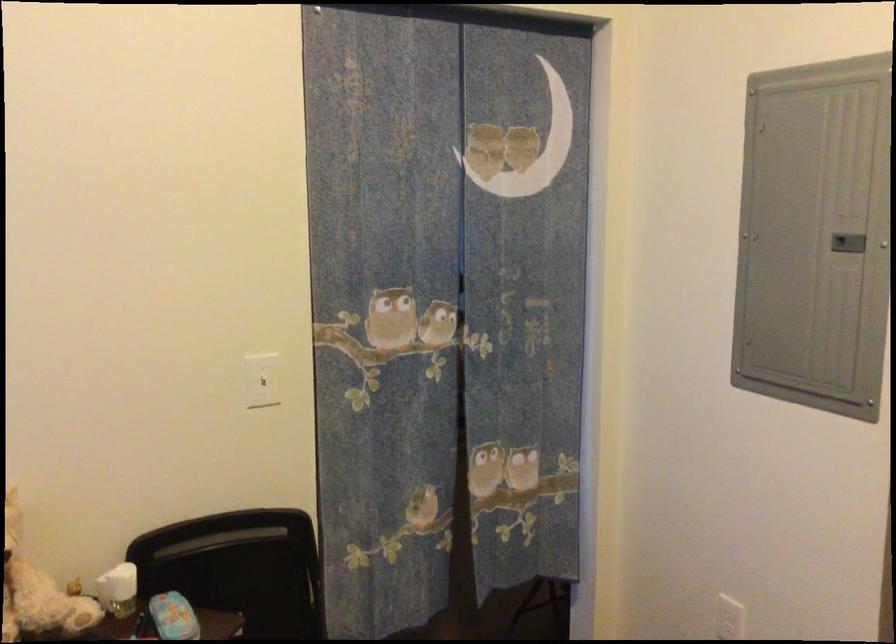
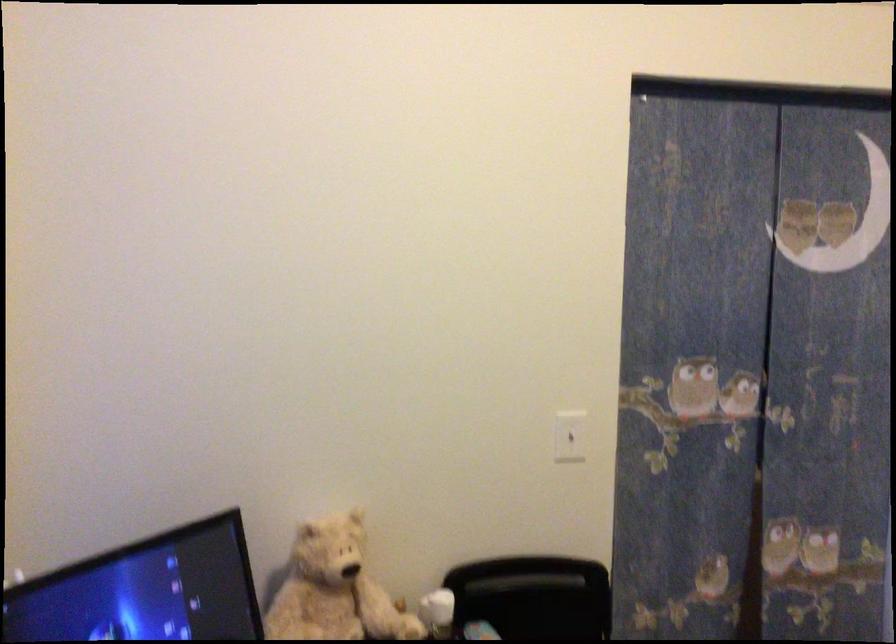
The point at (259, 380) is marked in the first image. Where is the corresponding point in the second image?

(570, 436)